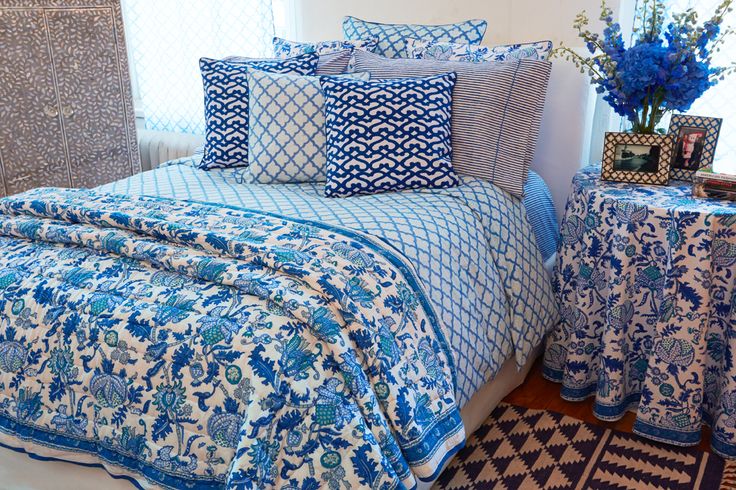
Locate an element on the screen. The width and height of the screenshot is (736, 490). picture frames is located at coordinates (704, 158), (662, 163).